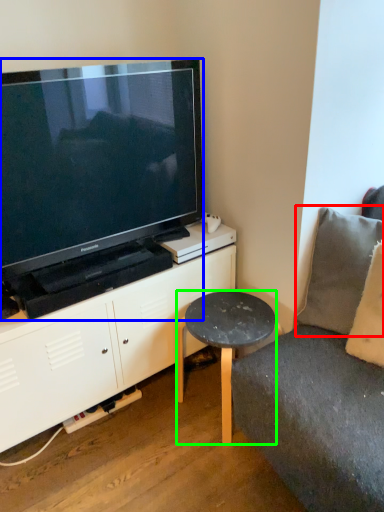
Question: Which object is the farthest from pillow (highlighted by a red box)? Choose among these: television (highlighted by a blue box) or table (highlighted by a green box).

Choices:
 (A) television
 (B) table

Answer: (A)